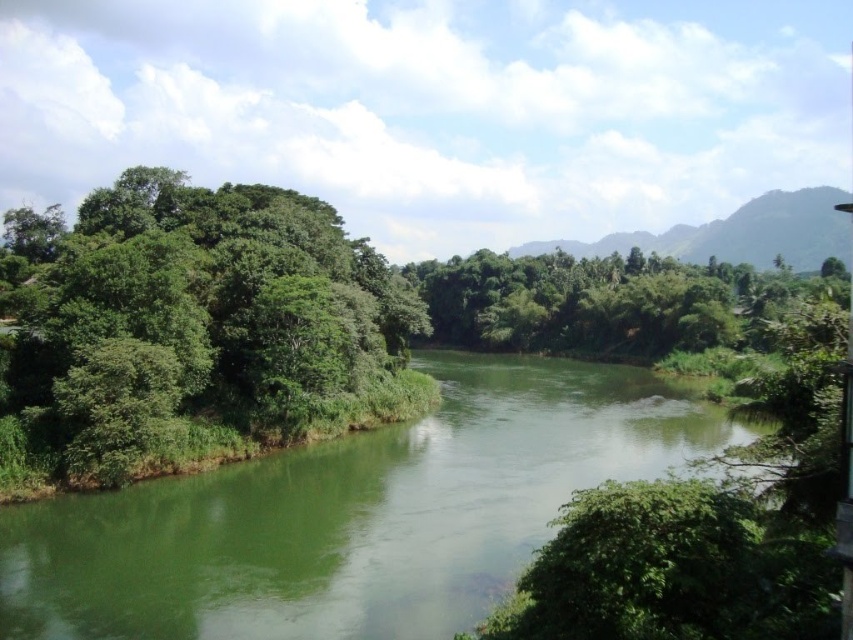
You are standing at the point marked by coordinates point (354, 515) in the image. What is the immediate environment around you like?

The point (354, 515) marks green smooth river at center, so you are standing in the middle of a calm river surrounded by lush green vegetation on both banks and a backdrop of mountains.